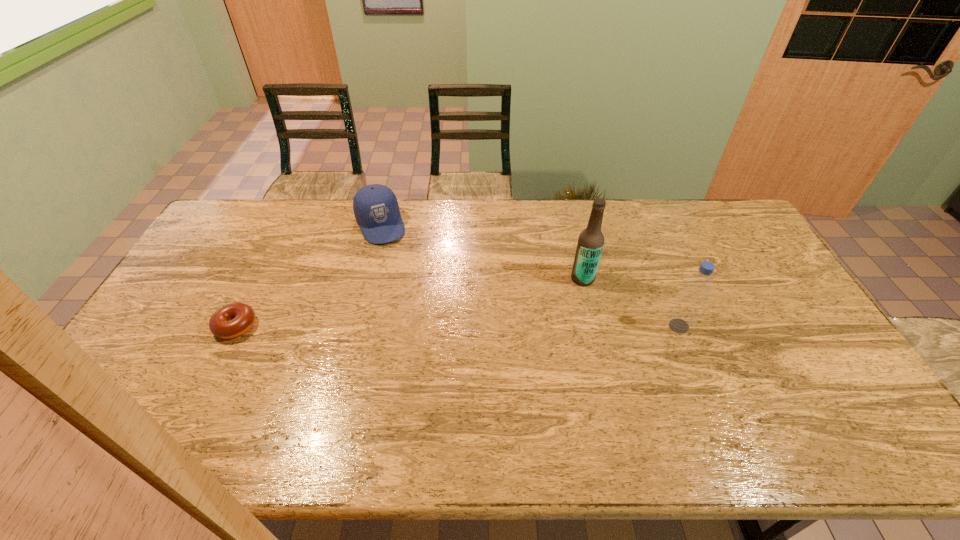
Where is `free space between the third object from right to left and the doughnut`? free space between the third object from right to left and the doughnut is located at coordinates (308, 275).

Find the location of a particular element. This screenshot has height=540, width=960. vacant area that lies between the third nearest object and the second shortest object is located at coordinates (482, 252).

Find the location of a particular element. vacant space that's between the third shortest object and the doughnut is located at coordinates (457, 326).

At what (x,y) coordinates should I click in order to perform the action: click on vacant point located between the beer bottle and the rightmost object. Please return your answer as a coordinate pair (x, y). This screenshot has width=960, height=540. Looking at the image, I should click on (631, 302).

Find the location of a particular element. This screenshot has height=540, width=960. the second closest object to the bottle is located at coordinates pos(375,206).

Locate which object is the third closest to the farthest object. Please provide its 2D coordinates. Your answer should be formatted as a tuple, i.e. [(x, y)], where the tuple contains the x and y coordinates of a point satisfying the conditions above.

[(698, 286)]

Identify the location of vacant space that satisfies the following two spatial constraints: 1. on the back side of the shortest object; 2. on the right side of the second object from left to right. (286, 225).

Locate an element on the screen. The height and width of the screenshot is (540, 960). blank space that satisfies the following two spatial constraints: 1. on the front side of the shortest object; 2. on the right side of the third shortest object is located at coordinates (236, 326).

Locate an element on the screen. This screenshot has height=540, width=960. vacant region that satisfies the following two spatial constraints: 1. on the front side of the third object from right to left; 2. on the left side of the rightmost object is located at coordinates (354, 326).

What are the coordinates of `vacant area in the image that satisfies the following two spatial constraints: 1. on the back side of the farthest object; 2. on the right side of the doughnut` in the screenshot? It's located at 286,225.